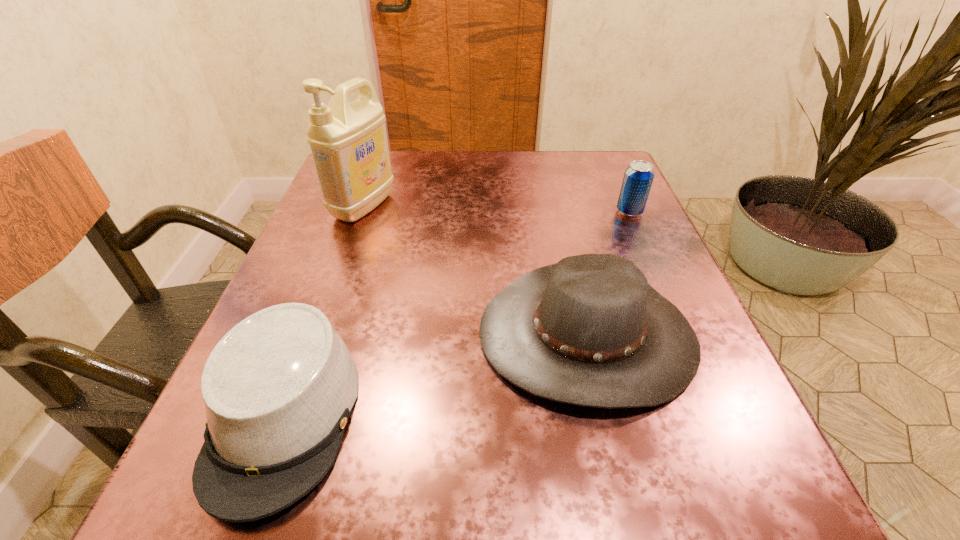
Find the location of a particular element. The image size is (960, 540). hat present at the right edge is located at coordinates (589, 330).

Locate an element on the screen. beer can located at the right edge is located at coordinates (638, 177).

Where is `object at the far left corner`? The height and width of the screenshot is (540, 960). object at the far left corner is located at coordinates (348, 141).

Locate an element on the screen. This screenshot has width=960, height=540. object that is at the near left corner is located at coordinates (279, 387).

You are a GUI agent. You are given a task and a screenshot of the screen. Output one action in this format:
    pyautogui.click(x=<x>, y=<y>)
    Task: Click on the vacant region at the far edge of the desktop
    The height and width of the screenshot is (540, 960).
    Given the screenshot: What is the action you would take?
    pyautogui.click(x=490, y=154)

This screenshot has width=960, height=540. In the image, there is a desktop. In order to click on vacant space at the near edge in this screenshot , I will do `click(523, 475)`.

This screenshot has width=960, height=540. Find the location of `vacant space at the left edge of the desktop`. vacant space at the left edge of the desktop is located at coordinates (356, 319).

The image size is (960, 540). Identify the location of vacant area at the right edge. (609, 211).

Identify the location of free region at the far right corner of the desktop. (577, 160).

The image size is (960, 540). What are the coordinates of `free space between the detergent and the right hat` in the screenshot? It's located at (475, 271).